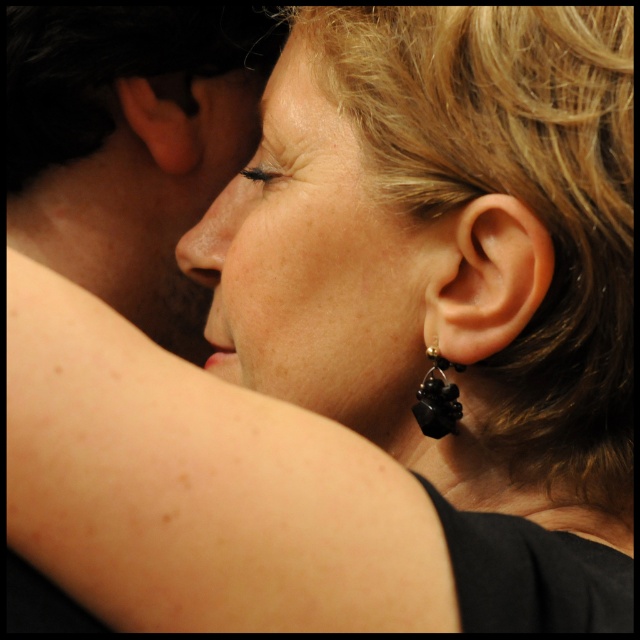
Question: Which point appears closest to the camera in this image?

Choices:
 (A) (312, 134)
 (B) (205, 230)
 (C) (420, 410)

Answer: (C)

Question: Is smooth skin arm at center to the right of matte black ear at left from the viewer's perspective?

Choices:
 (A) yes
 (B) no

Answer: (A)

Question: Which point is farther to the camera?

Choices:
 (A) (424, 320)
 (B) (198, 150)
 (C) (452, 387)

Answer: (B)

Question: Does matte black hair at upper left appear on the left side of smooth skin face at center?

Choices:
 (A) no
 (B) yes

Answer: (B)

Question: Is smooth skin face at center wider than matte black ear at left?

Choices:
 (A) no
 (B) yes

Answer: (B)

Question: Which object appears closest to the camera in this image?

Choices:
 (A) matte black ear at left
 (B) matte skin nose at center
 (C) satin black earring at right
 (D) black glass earring at ear

Answer: (C)